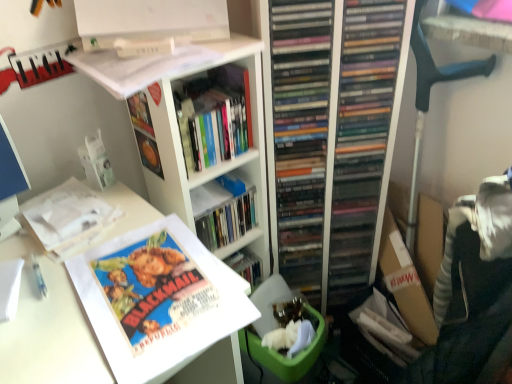
At what (x,y) coordinates should I click in order to perform the action: click on free spot above matte paper poster at lower left, which appears as the third book when viewed from the top (from a real-world perspective). Please return your answer as a coordinate pair (x, y). Image resolution: width=512 pixels, height=384 pixels. Looking at the image, I should click on (153, 278).